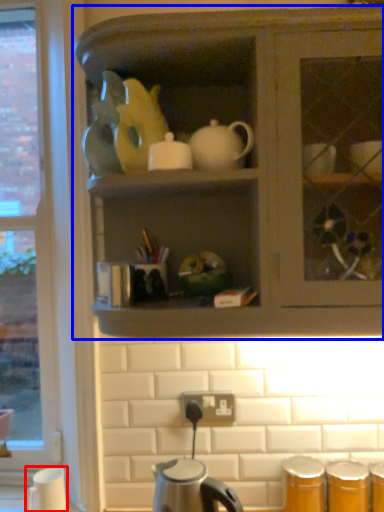
Question: Among these objects, which one is farthest to the camera, coffee cup (highlighted by a red box) or cabinetry (highlighted by a blue box)?

Choices:
 (A) coffee cup
 (B) cabinetry

Answer: (A)